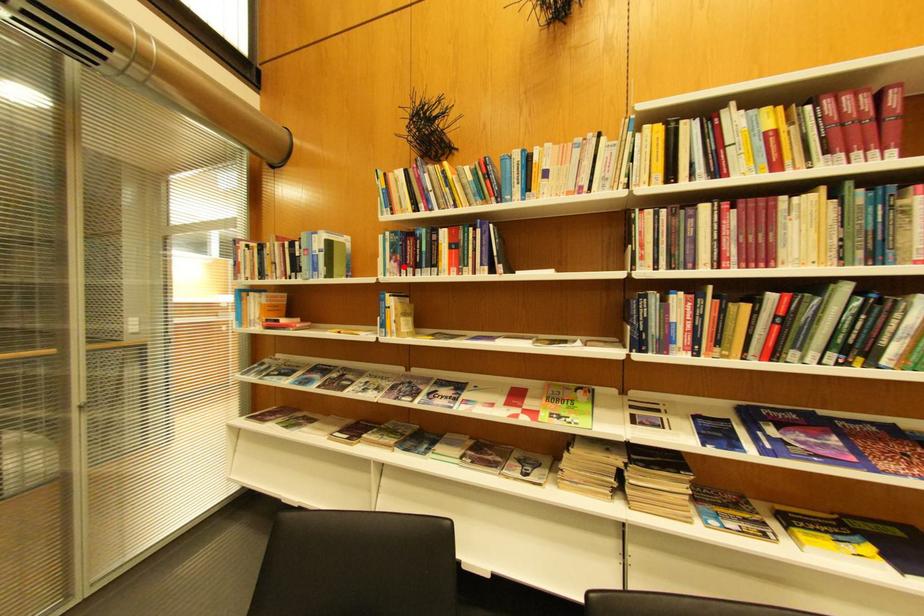
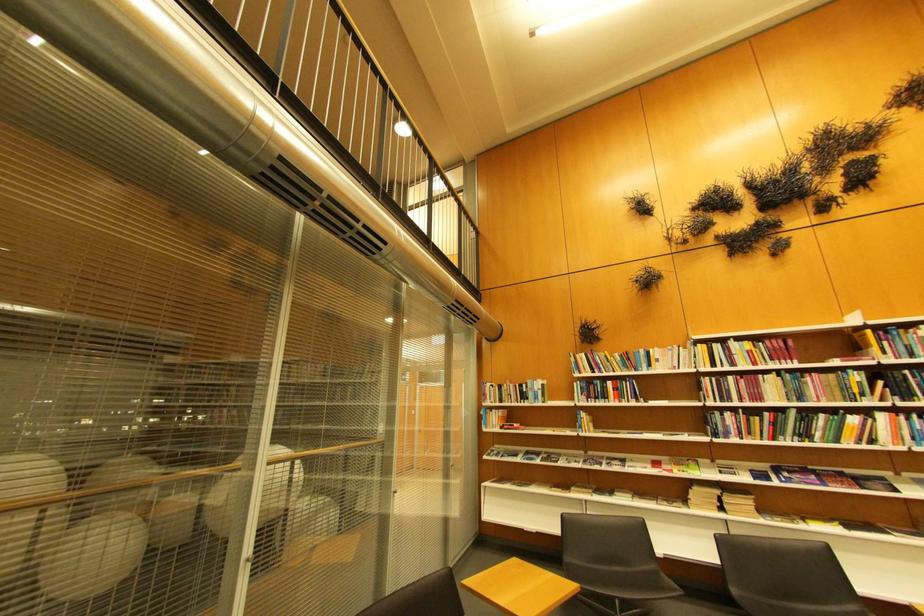
Question: I am providing you with two images of the same scene from different viewpoints. In image1, a red point is highlighted. Considering the same 3D point in image2, which of the following is correct?

Choices:
 (A) It is closer
 (B) It is farther

Answer: (B)